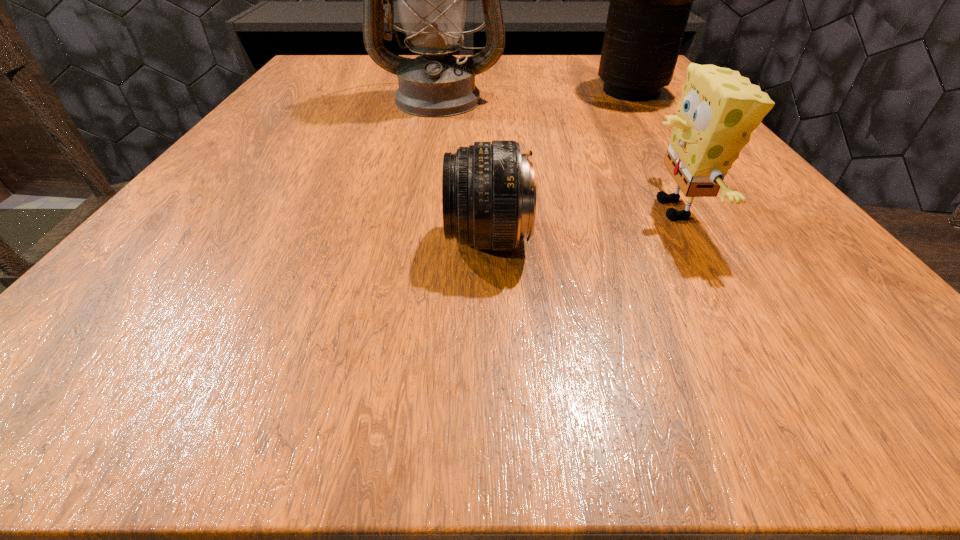
Find the location of `empty space that is in between the sponge and the tallest object`. empty space that is in between the sponge and the tallest object is located at coordinates (557, 154).

At what (x,y) coordinates should I click in order to perform the action: click on vacant area that lies between the third shortest object and the second shortest object. Please return your answer as a coordinate pair (x, y). Looking at the image, I should click on (653, 151).

Where is `free space between the tallest object and the right telephoto lens`? The image size is (960, 540). free space between the tallest object and the right telephoto lens is located at coordinates (535, 95).

Locate an element on the screen. The width and height of the screenshot is (960, 540). free space that is in between the third tallest object and the farther telephoto lens is located at coordinates (653, 151).

Where is `object that is the closest to the farther telephoto lens`? The height and width of the screenshot is (540, 960). object that is the closest to the farther telephoto lens is located at coordinates (432, 0).

Choose which object is the second nearest neighbor to the left telephoto lens. Please provide its 2D coordinates. Your answer should be formatted as a tuple, i.e. [(x, y)], where the tuple contains the x and y coordinates of a point satisfying the conditions above.

[(432, 0)]

Where is `free spot that satisfies the following two spatial constraints: 1. on the back side of the tallest object; 2. on the right side of the taller telephoto lens`? free spot that satisfies the following two spatial constraints: 1. on the back side of the tallest object; 2. on the right side of the taller telephoto lens is located at coordinates (440, 92).

Where is `blank area in the image that satisfies the following two spatial constraints: 1. on the back side of the farther telephoto lens; 2. on the right side of the oil lamp`? This screenshot has height=540, width=960. blank area in the image that satisfies the following two spatial constraints: 1. on the back side of the farther telephoto lens; 2. on the right side of the oil lamp is located at coordinates (440, 92).